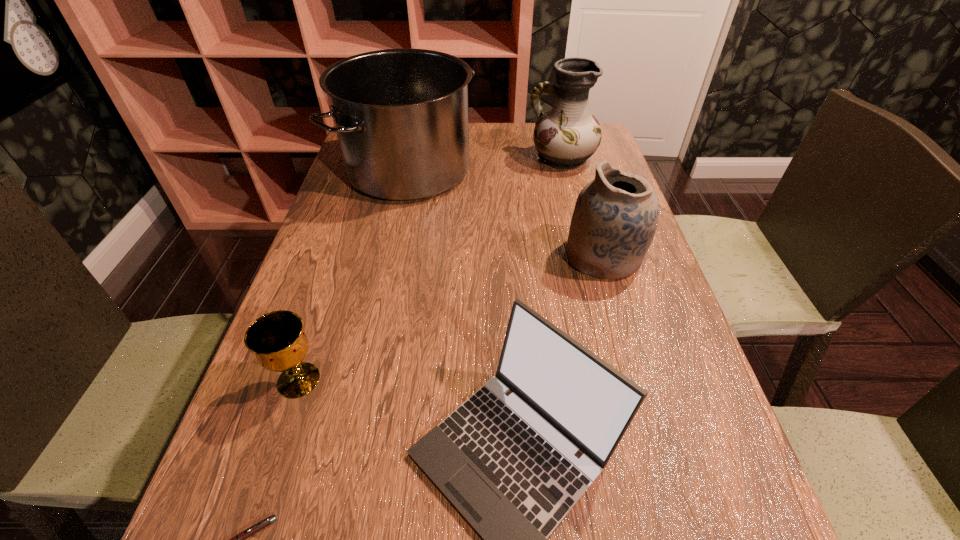
Where is `blank region between the chalice and the fourth shortest object`? This screenshot has height=540, width=960. blank region between the chalice and the fourth shortest object is located at coordinates (451, 318).

Identify the location of empty space that is in between the chalice and the saucepan. (354, 275).

Locate an element on the screen. free space between the vase and the saucepan is located at coordinates (486, 164).

Find the location of a particular element. Image resolution: width=960 pixels, height=540 pixels. free spot between the pottery and the saucepan is located at coordinates (506, 213).

Select which object appears as the fourth closest to the laptop_computer. Please provide its 2D coordinates. Your answer should be formatted as a tuple, i.e. [(x, y)], where the tuple contains the x and y coordinates of a point satisfying the conditions above.

[(401, 118)]

Locate an element on the screen. Image resolution: width=960 pixels, height=540 pixels. object that is the fourth closest to the laptop_computer is located at coordinates (401, 118).

Find the location of a particular element. vacant point that satisfies the following two spatial constraints: 1. on the back side of the chalice; 2. on the right side of the vase is located at coordinates (372, 159).

Identify the location of free spot that satisfies the following two spatial constraints: 1. on the back side of the chalice; 2. on the right side of the vase. The height and width of the screenshot is (540, 960). 372,159.